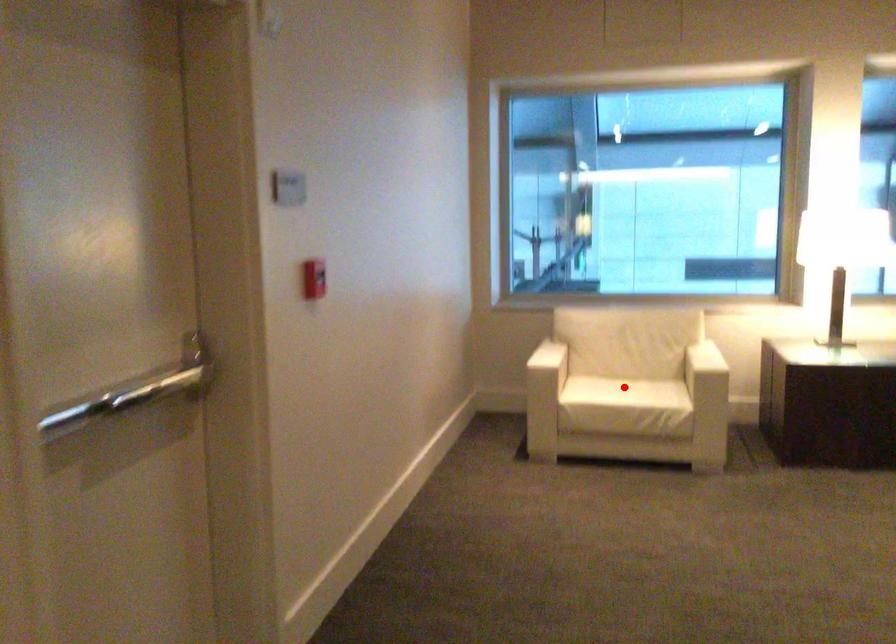
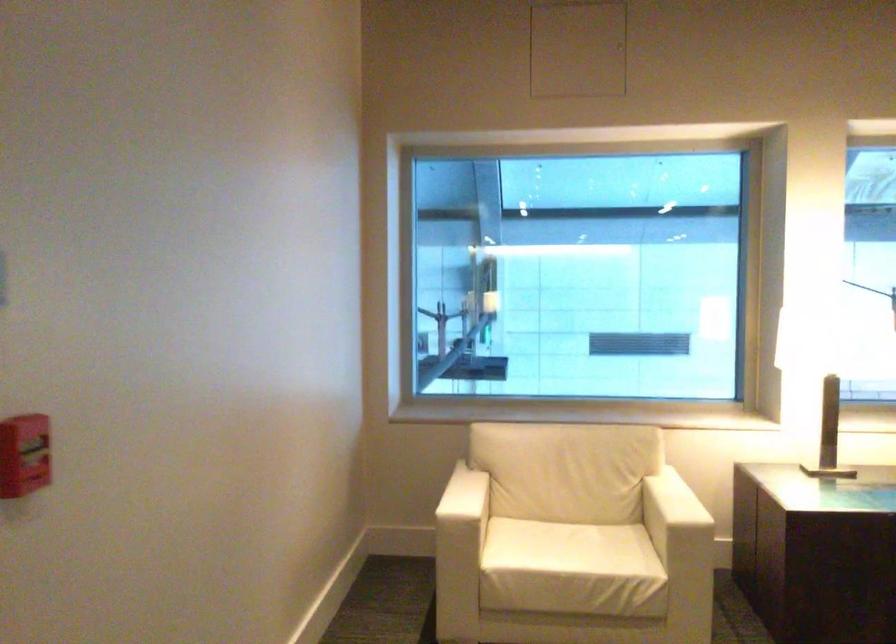
In the second image, find the point that corresponds to the highlighted location in the first image.

(566, 547)